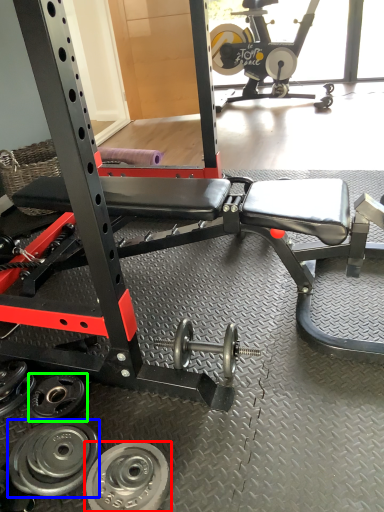
Question: Which object is positioned closest to wheel (highlighted by a red box)? Select from wheel (highlighted by a blue box) and wheel (highlighted by a green box).

Choices:
 (A) wheel
 (B) wheel

Answer: (A)